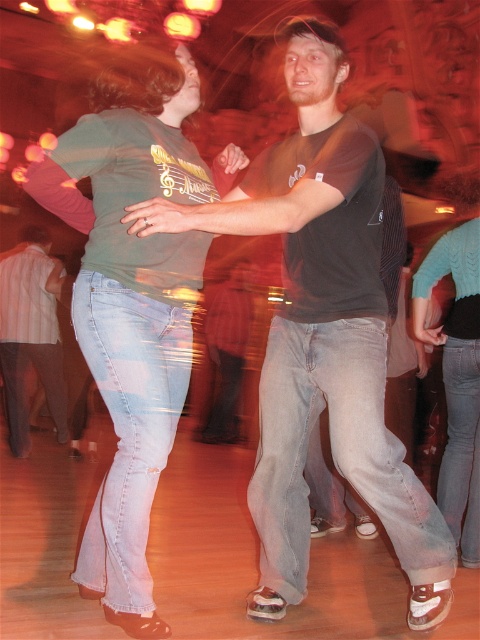
Which is behind, point (156, 92) or point (48, 394)?

The point (48, 394) is more distant.

Describe the element at coordinates (132, 304) in the screenshot. I see `matte green t-shirt at center` at that location.

Describe the element at coordinates (132, 304) in the screenshot. The height and width of the screenshot is (640, 480). I see `matte green t-shirt at center` at that location.

Locate an element on the screen. The width and height of the screenshot is (480, 640). matte green t-shirt at center is located at coordinates (132, 304).

Is matte black t-shirt at center bigger than matte green t-shirt at center?

Indeed, matte black t-shirt at center has a larger size compared to matte green t-shirt at center.

Is matte black t-shirt at center positioned before matte green t-shirt at center?

Yes.

Is point (360, 410) positioned before point (238, 157)?

Yes, it is.

What are the coordinates of `matte black t-shirt at center` in the screenshot? It's located at (322, 333).

Who is positioned more to the left, matte black t-shirt at center or denim jeans at left?

denim jeans at left is more to the left.

Is matte black t-shirt at center closer to camera compared to denim jeans at left?

Yes, it is.

Find the location of a particular element. matte black t-shirt at center is located at coordinates (322, 333).